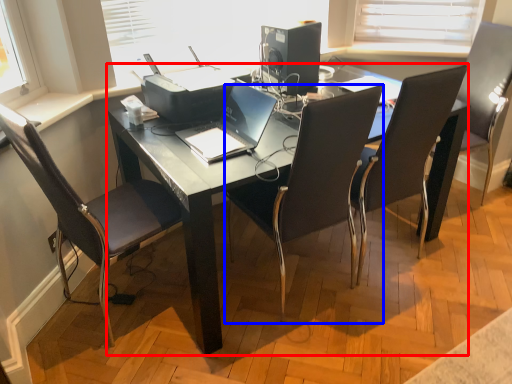
Question: Among these objects, which one is nearest to the camera, desk (highlighted by a red box) or chair (highlighted by a blue box)?

Choices:
 (A) desk
 (B) chair

Answer: (B)